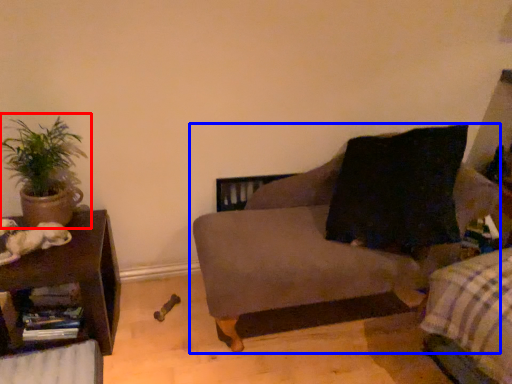
Question: Among these objects, which one is farthest to the camera, houseplant (highlighted by a red box) or studio couch (highlighted by a blue box)?

Choices:
 (A) houseplant
 (B) studio couch

Answer: (A)